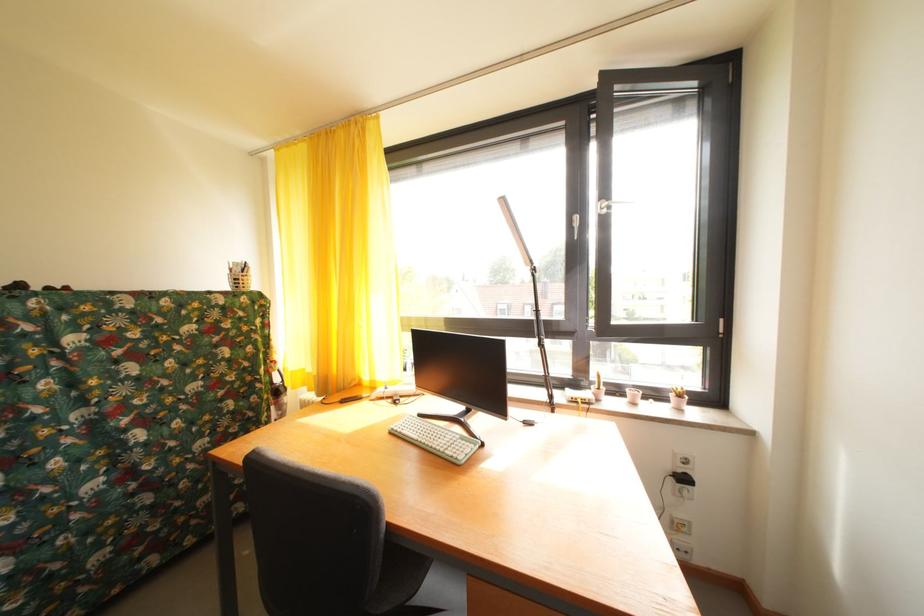
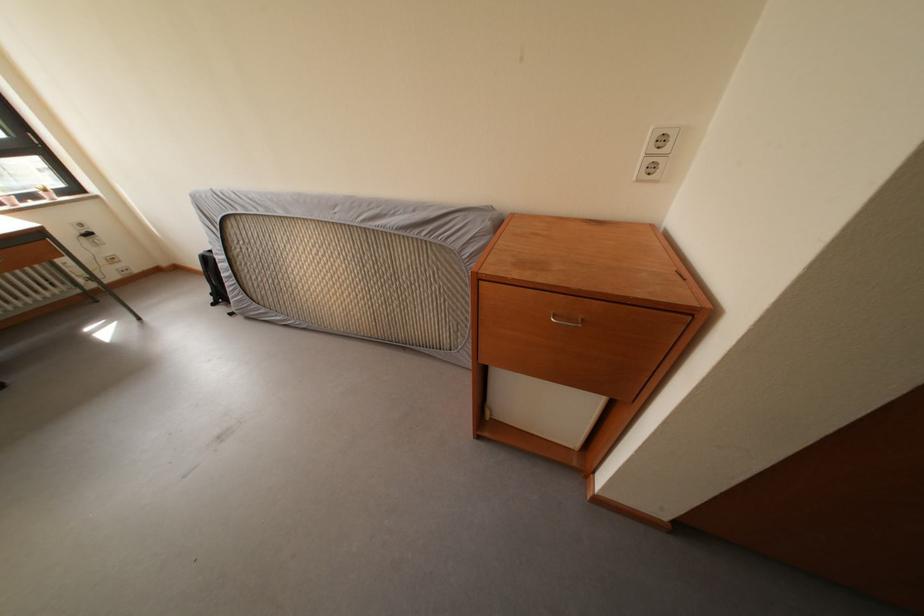
Where in the second image is the point corresponding to pixel 688 545 from the first image?

(128, 273)